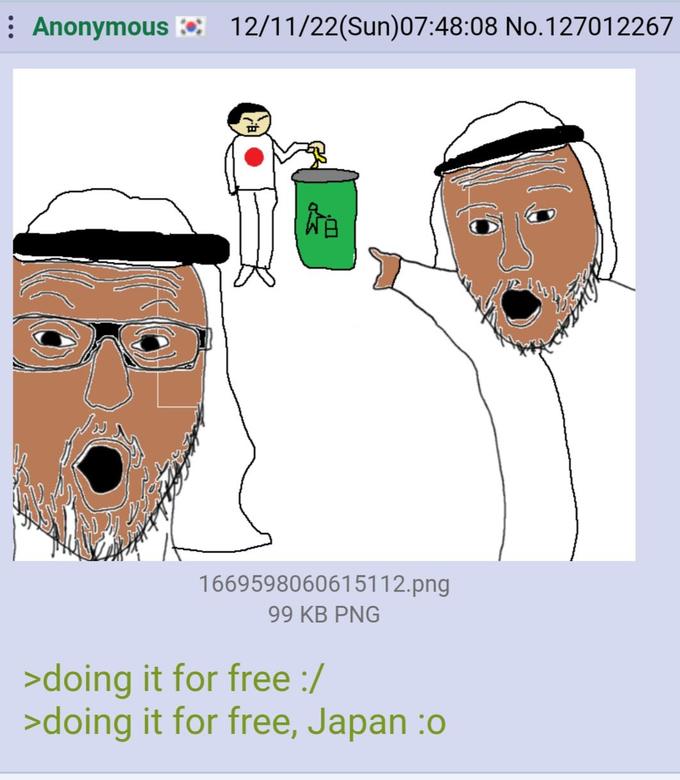
The image size is (680, 780). I want to click on robe, so click(575, 429).